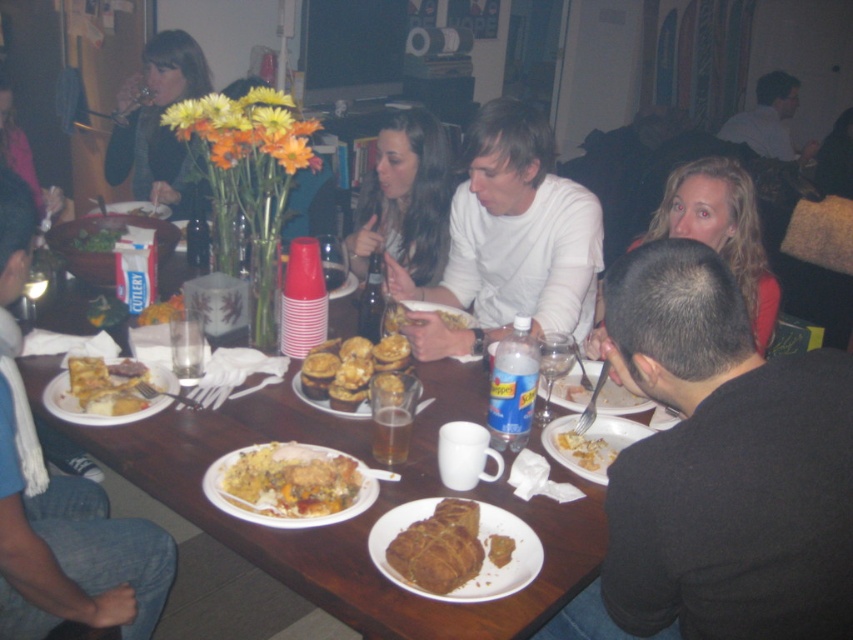
Is golden-brown muffins at center smaller than matte white plate at center?

Indeed, golden-brown muffins at center has a smaller size compared to matte white plate at center.

Who is taller, golden-brown muffins at center or matte white plate at center?

Standing taller between the two is matte white plate at center.

Is point (350, 413) positioned before point (142, 216)?

Yes, it is.

This screenshot has height=640, width=853. In order to click on golden-brown muffins at center in this screenshot , I will do `click(329, 401)`.

Looking at this image, can you confirm if blonde hair at upper right is positioned below golden brown bread at center?

Incorrect, blonde hair at upper right is not positioned below golden brown bread at center.

Between blonde hair at upper right and golden brown bread at center, which one has less height?

golden brown bread at center

Who is more distant from viewer, (759, 282) or (500, 538)?

Positioned behind is point (759, 282).

Find the location of a particular element. This screenshot has height=640, width=853. blonde hair at upper right is located at coordinates (721, 230).

Does matte black fork at left appear under yellow matte scrambled eggs at lower center?

Incorrect, matte black fork at left is not positioned below yellow matte scrambled eggs at lower center.

Between matte black fork at left and yellow matte scrambled eggs at lower center, which one is positioned lower?

yellow matte scrambled eggs at lower center is lower down.

Measure the distance between point (44, 528) and camera.

4.97 feet

Image resolution: width=853 pixels, height=640 pixels. I want to click on matte black fork at left, so click(71, 550).